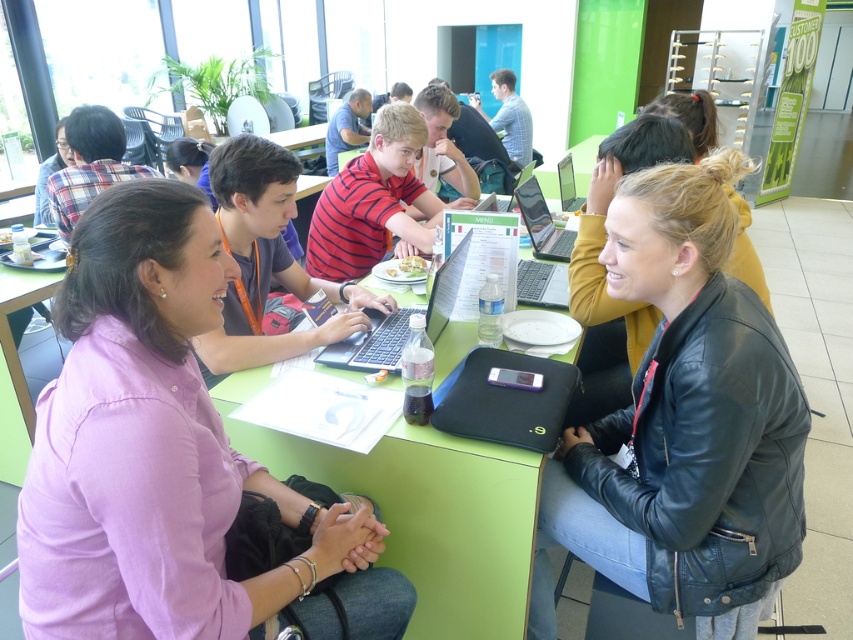
Does green matte table at center have a greater width compared to green plastic table at lower left?

Indeed, green matte table at center has a greater width compared to green plastic table at lower left.

Is the position of green matte table at center more distant than that of green plastic table at lower left?

No.

Measure the distance between point (368, 467) and camera.

Point (368, 467) and camera are 4.58 feet apart.

I want to click on green matte table at center, so click(425, 513).

Is point (606, 243) less distant than point (428, 323)?

Yes.

Does black leather jacket at center have a larger size compared to shiny black laptop at center?

Indeed, black leather jacket at center has a larger size compared to shiny black laptop at center.

Between point (698, 628) and point (360, 362), which one is positioned in front?

Point (698, 628) is in front.

Find the location of `black leather jacket at center`. black leather jacket at center is located at coordinates (683, 424).

This screenshot has height=640, width=853. What do you see at coordinates (498, 262) in the screenshot?
I see `black matte laptop at center` at bounding box center [498, 262].

Does black matte laptop at center appear on the left side of shiny black laptop at center?

In fact, black matte laptop at center is to the right of shiny black laptop at center.

Is point (538, 275) more distant than point (397, 340)?

Yes, point (538, 275) is behind point (397, 340).

Locate an element on the screen. This screenshot has width=853, height=640. black matte laptop at center is located at coordinates (498, 262).